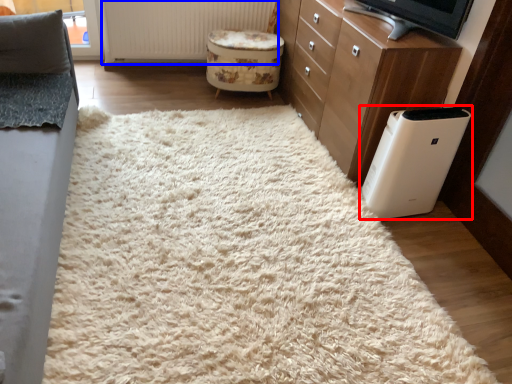
Question: Among these objects, which one is nearest to the camera, home appliance (highlighted by a red box) or radiator (highlighted by a blue box)?

Choices:
 (A) home appliance
 (B) radiator

Answer: (A)